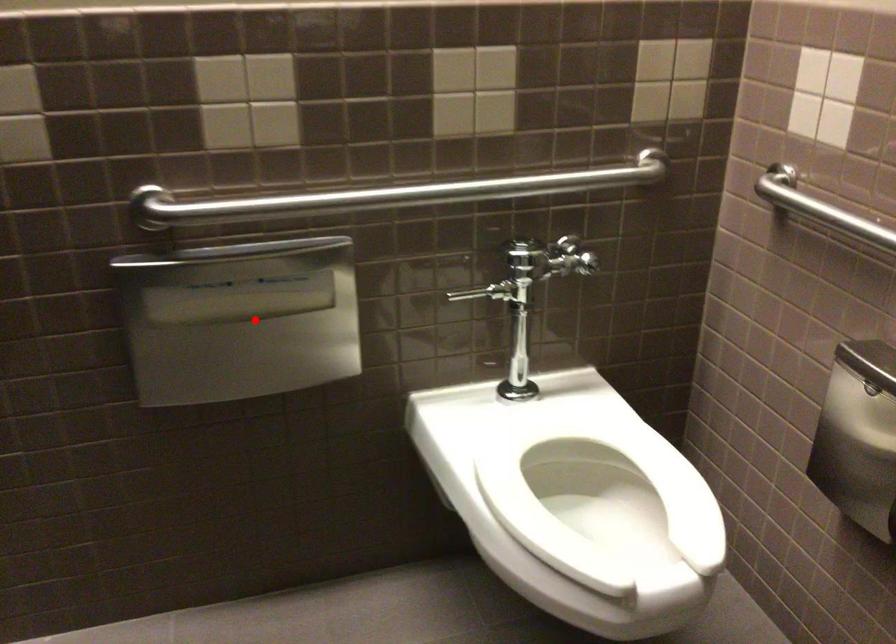
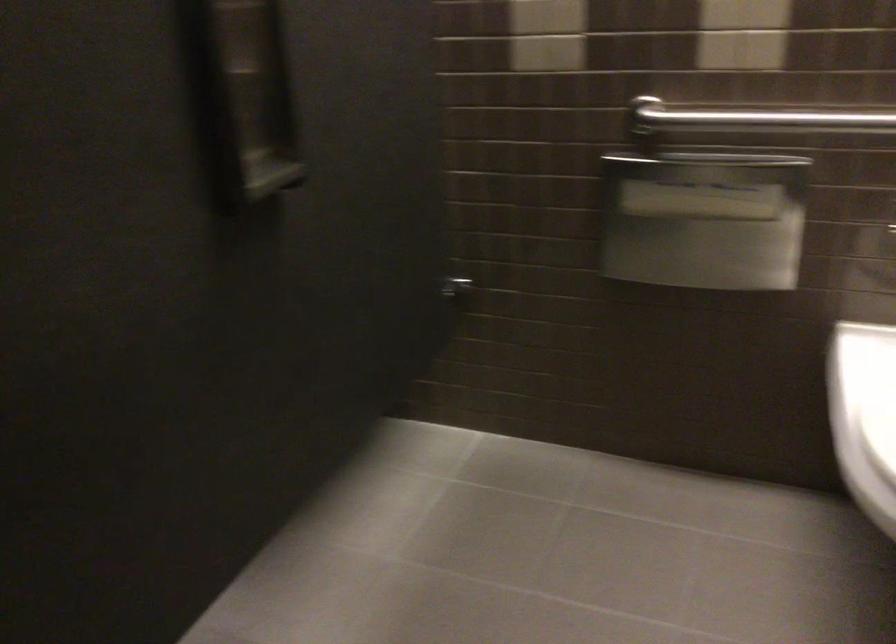
Question: I am providing you with two images of the same scene from different viewpoints. A red point is shown in image1. For the corresponding object point in image2, is it positioned nearer or farther from the camera?

Choices:
 (A) Nearer
 (B) Farther

Answer: (B)